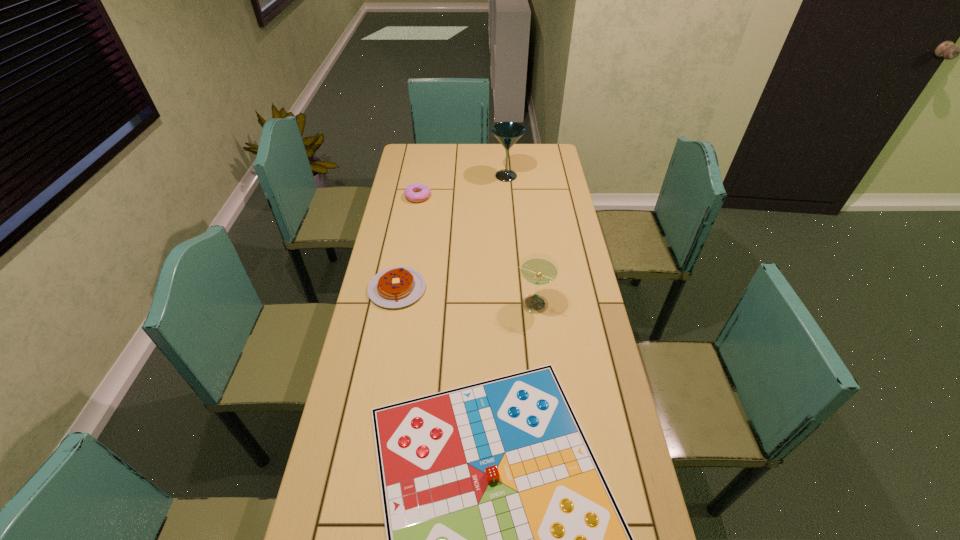
I want to click on object that is at the far edge, so click(507, 133).

Identify the location of doughnut present at the left edge. (416, 192).

This screenshot has width=960, height=540. What are the coordinates of `pancake that is at the left edge` in the screenshot? It's located at (394, 287).

Where is `object that is at the right edge`? This screenshot has height=540, width=960. object that is at the right edge is located at coordinates (539, 269).

In order to click on vacant space at the far edge in this screenshot , I will do coord(495,145).

Locate an element on the screen. vacant area at the left edge is located at coordinates (407, 183).

Where is `blank area at the right edge`? This screenshot has height=540, width=960. blank area at the right edge is located at coordinates (576, 353).

At what (x,y) coordinates should I click in order to perform the action: click on vacant region at the far left corner of the desktop. Please return your answer as a coordinate pair (x, y). The width and height of the screenshot is (960, 540). Looking at the image, I should click on (428, 167).

In order to click on free spot at the far right corner of the desktop in this screenshot , I will do `click(540, 164)`.

I want to click on free space between the tallest object and the second tallest object, so click(519, 240).